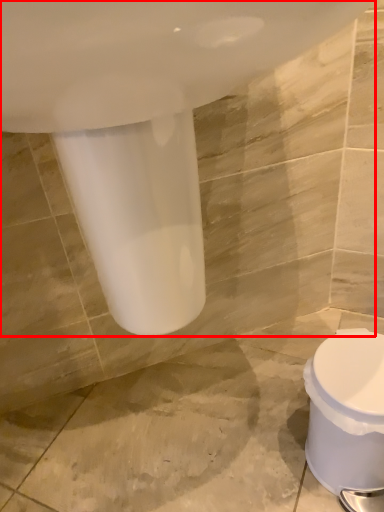
Question: From the image, what is the correct spatial relationship of bath (annotated by the red box) in relation to toilet?

Choices:
 (A) left
 (B) right

Answer: (A)